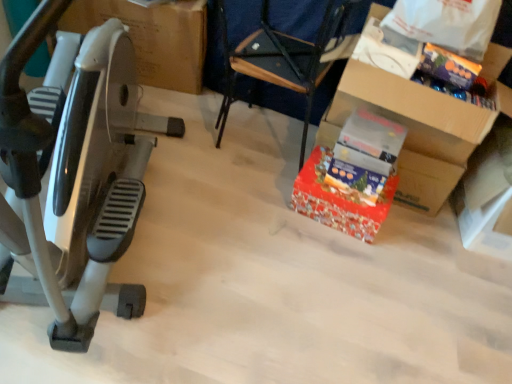
Question: Are red glossy gift at center, which appears as the 1th gift when viewed from the left, and matte cardboard box at left, arranged as the second cardboard box when viewed from the right, making contact?

Choices:
 (A) no
 (B) yes

Answer: (A)

Question: Does red glossy gift at center, the second gift in the top-to-bottom sequence, lie in front of matte cardboard box at left, arranged as the second cardboard box when viewed from the right?

Choices:
 (A) no
 (B) yes

Answer: (B)

Question: Is red glossy gift at center, which is the second gift in right-to-left order, shorter than matte cardboard box at left, arranged as the second cardboard box when viewed from the right?

Choices:
 (A) yes
 (B) no

Answer: (A)

Question: Can you confirm if red glossy gift at center, which appears as the 1th gift when viewed from the left, is positioned to the right of matte cardboard box at left, placed as the 1th cardboard box when sorted from back to front?

Choices:
 (A) no
 (B) yes

Answer: (B)

Question: Is red glossy gift at center, which is the second gift in right-to-left order, far from matte cardboard box at left, placed as the 1th cardboard box when sorted from back to front?

Choices:
 (A) yes
 (B) no

Answer: (A)

Question: Can you confirm if red glossy gift at center, which appears as the 1th gift when viewed from the left, is thinner than matte cardboard box at left, placed as the 1th cardboard box when sorted from back to front?

Choices:
 (A) no
 (B) yes

Answer: (B)

Question: Is red glossy gift at center, which is the second gift in right-to-left order, located within blue fabric armchair at center?

Choices:
 (A) yes
 (B) no

Answer: (B)

Question: Are blue fabric armchair at center and red glossy gift at center, the second gift in the top-to-bottom sequence, beside each other?

Choices:
 (A) no
 (B) yes

Answer: (A)

Question: Is blue fabric armchair at center positioned far away from red glossy gift at center, which appears as the 1th gift when viewed from the left?

Choices:
 (A) no
 (B) yes

Answer: (A)

Question: From the image's perspective, is blue fabric armchair at center located beneath red glossy gift at center, which is the second gift in right-to-left order?

Choices:
 (A) no
 (B) yes

Answer: (A)

Question: Is blue fabric armchair at center positioned before red glossy gift at center, the second gift in the top-to-bottom sequence?

Choices:
 (A) yes
 (B) no

Answer: (A)

Question: Can you confirm if blue fabric armchair at center is bigger than red glossy gift at center, positioned as the 1th gift in bottom-to-top order?

Choices:
 (A) yes
 (B) no

Answer: (A)

Question: From the image's perspective, is shiny purple candy at upper right, marked as the 2th gift in a bottom-to-top arrangement, located above blue fabric armchair at center?

Choices:
 (A) no
 (B) yes

Answer: (A)